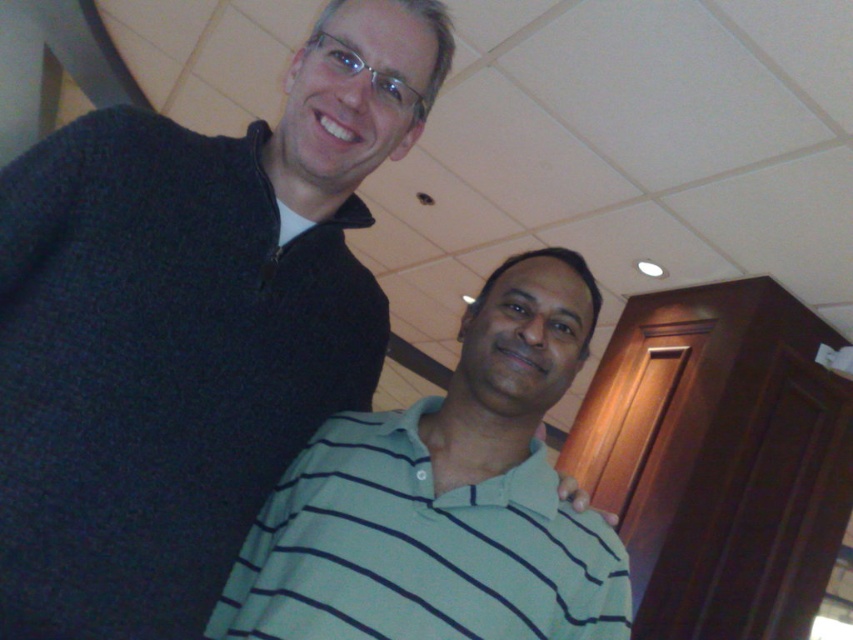
Question: Is the position of dark blue sweater at upper left less distant than that of light blue striped polo shirt at center?

Choices:
 (A) yes
 (B) no

Answer: (A)

Question: Which point is closer to the camera?

Choices:
 (A) light blue striped polo shirt at center
 (B) dark blue sweater at upper left

Answer: (B)

Question: Among these objects, which one is farthest from the camera?

Choices:
 (A) dark blue sweater at upper left
 (B) light blue striped polo shirt at center

Answer: (B)

Question: Does dark blue sweater at upper left appear on the left side of light blue striped polo shirt at center?

Choices:
 (A) yes
 (B) no

Answer: (A)

Question: Does dark blue sweater at upper left lie behind light blue striped polo shirt at center?

Choices:
 (A) no
 (B) yes

Answer: (A)